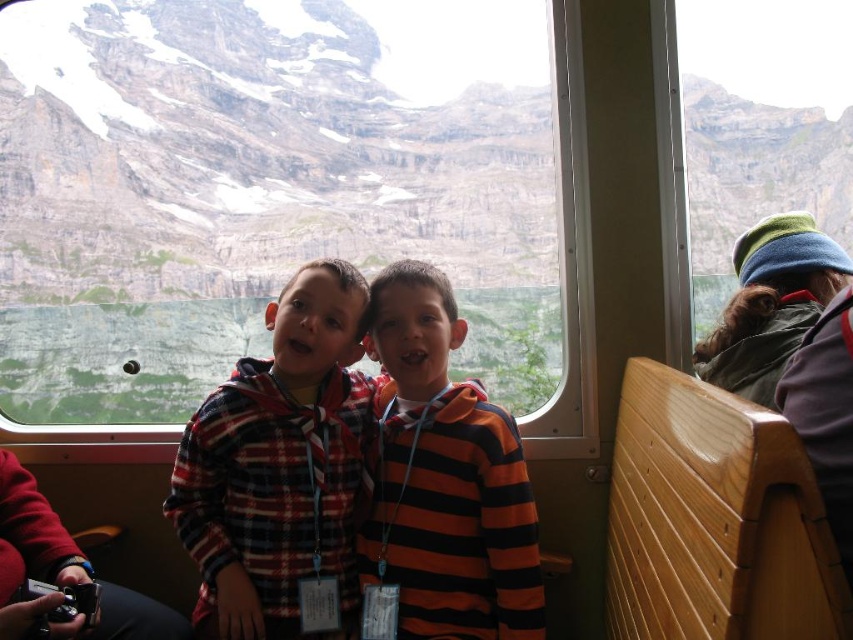
Question: Which point is farther from the camera taking this photo?

Choices:
 (A) (331, 310)
 (B) (432, 355)

Answer: (A)

Question: Among these objects, which one is farthest from the camera?

Choices:
 (A) orange striped hoodie at center
 (B) plaid fabric shirt at center

Answer: (B)

Question: Does plaid fabric shirt at center appear over orange striped hoodie at center?

Choices:
 (A) no
 (B) yes

Answer: (B)

Question: Does plaid fabric shirt at center have a greater width compared to orange striped hoodie at center?

Choices:
 (A) yes
 (B) no

Answer: (A)

Question: Does plaid fabric shirt at center have a lesser width compared to orange striped hoodie at center?

Choices:
 (A) no
 (B) yes

Answer: (A)